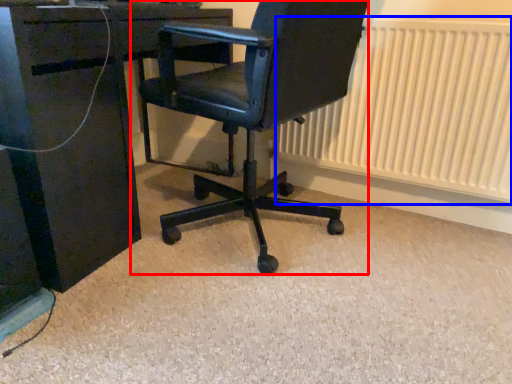
Question: Among these objects, which one is nearest to the camera, chair (highlighted by a red box) or radiator (highlighted by a blue box)?

Choices:
 (A) chair
 (B) radiator

Answer: (A)